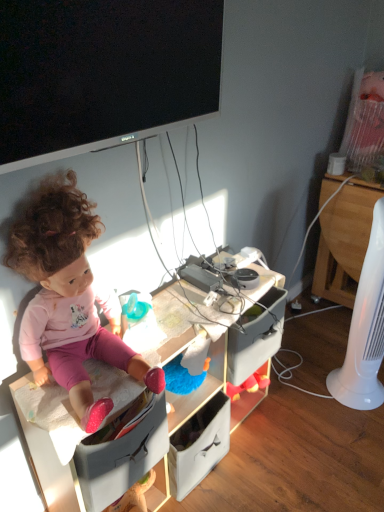
The width and height of the screenshot is (384, 512). What are the coordinates of `free point above matte plastic desk at center (from a real-world perspective)` in the screenshot? It's located at (175, 324).